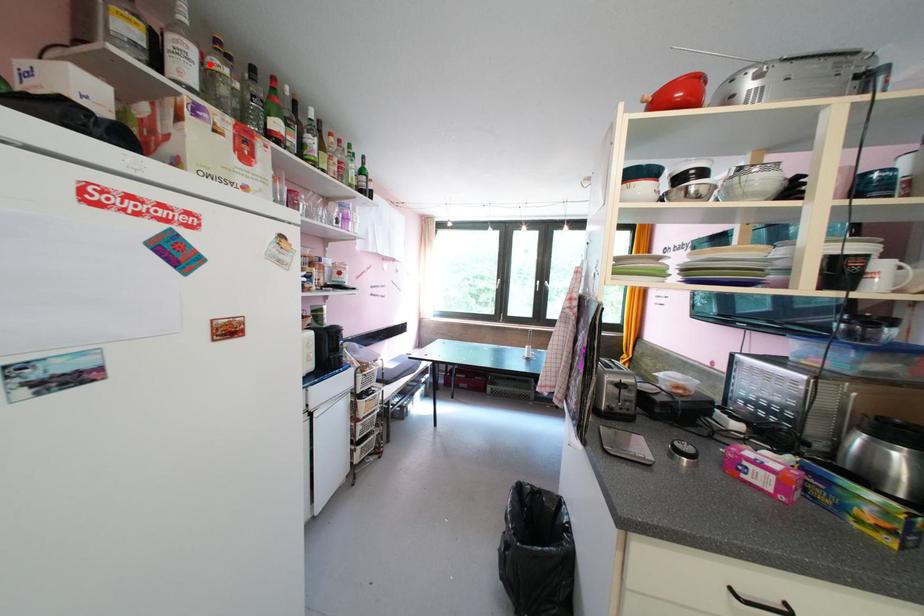
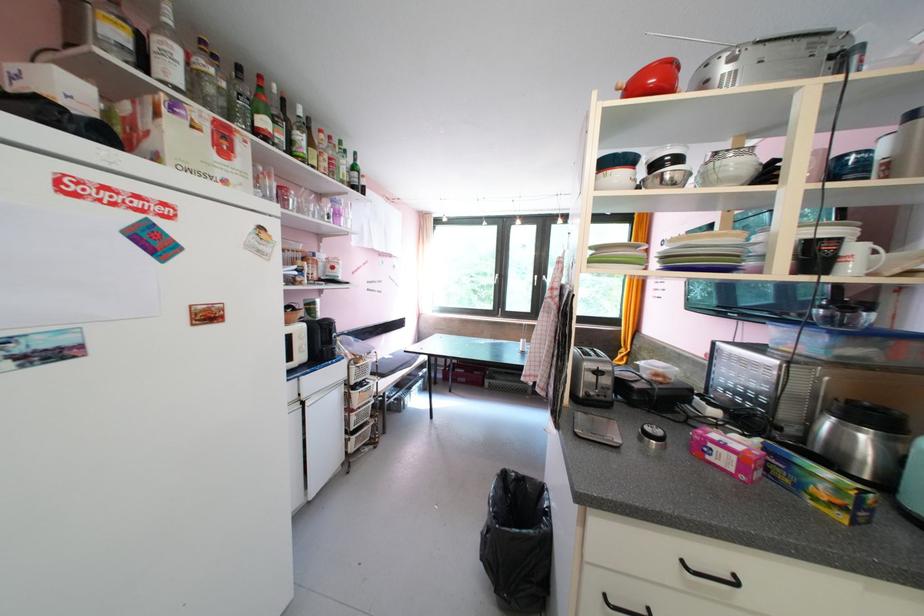
Where in the second image is the point corresponding to the highlighted location from the first image?

(196, 65)